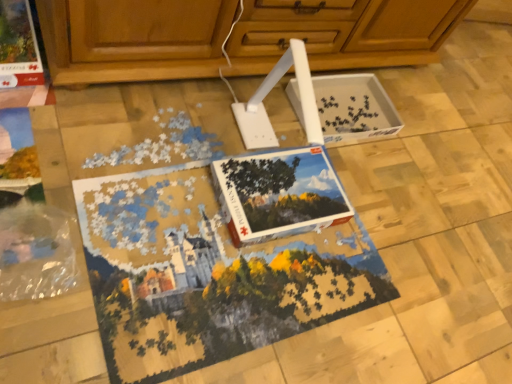
Locate an element on the screen. vacant space in front of white cardboard puzzle box at center, which is the 2th magazine from left to right is located at coordinates (229, 272).